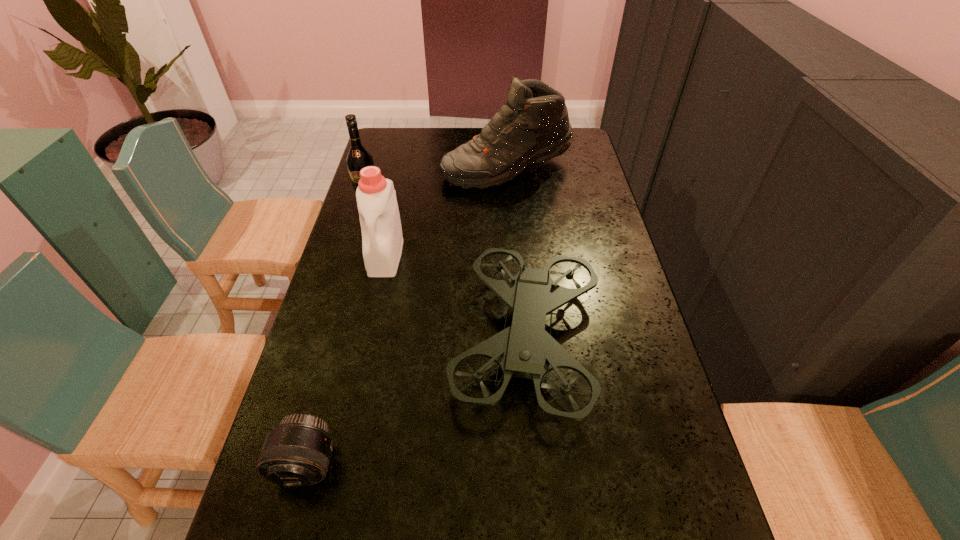
The width and height of the screenshot is (960, 540). I want to click on object present at the far edge, so click(x=532, y=127).

At what (x,y) coordinates should I click in order to perform the action: click on wine bottle that is positioned at the left edge. Please return your answer as a coordinate pair (x, y). The image size is (960, 540). Looking at the image, I should click on (358, 157).

Locate an element on the screen. The height and width of the screenshot is (540, 960). detergent that is at the left edge is located at coordinates (382, 241).

Identify the location of telephoto lens that is at the left edge. The image size is (960, 540). (297, 452).

At what (x,y) coordinates should I click in order to perform the action: click on ski boot positioned at the right edge. Please return your answer as a coordinate pair (x, y). Looking at the image, I should click on tap(532, 127).

You are a GUI agent. You are given a task and a screenshot of the screen. Output one action in this format:
    pyautogui.click(x=<x>, y=<y>)
    Task: Click on the drone positioned at the right edge
    This screenshot has width=960, height=540.
    Given the screenshot: What is the action you would take?
    coord(525,349)

This screenshot has height=540, width=960. In order to click on object present at the far right corner in this screenshot , I will do `click(532, 127)`.

Find the location of a particular element. The width and height of the screenshot is (960, 540). vacant space at the far edge of the desktop is located at coordinates (477, 130).

The image size is (960, 540). I want to click on vacant area at the left edge, so click(329, 379).

The height and width of the screenshot is (540, 960). Find the location of `vacant space at the right edge of the desktop`. vacant space at the right edge of the desktop is located at coordinates (606, 285).